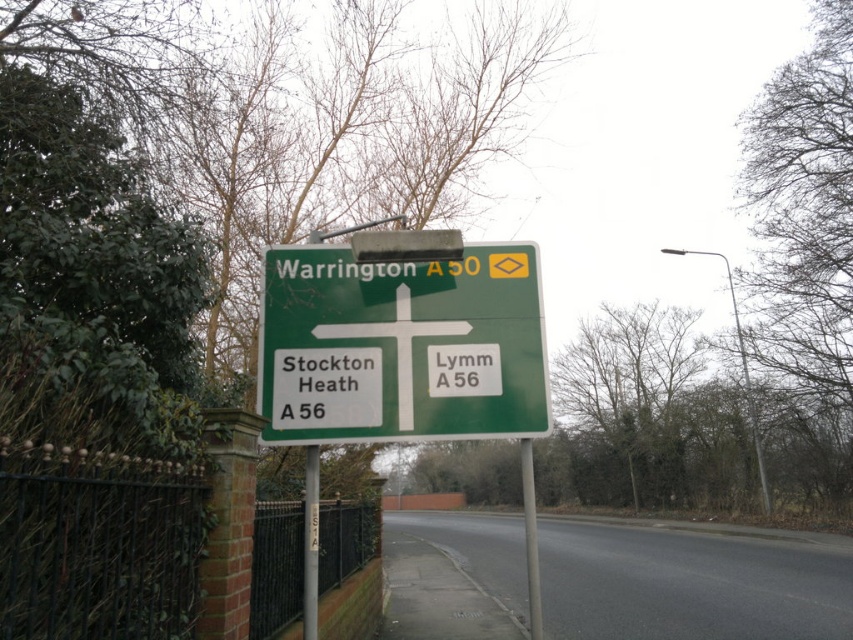
Which is more to the left, green matte sign at center or green plastic sign at center?

green matte sign at center

In the scene shown: Between green matte sign at center and green plastic sign at center, which one is positioned lower?

green plastic sign at center is below.

Who is more forward, [404,320] or [434,372]?

Point [434,372] is more forward.

Where is `green matte sign at center`? Image resolution: width=853 pixels, height=640 pixels. green matte sign at center is located at coordinates (401, 346).

Who is more distant from viewer, (439, 364) or (314, 445)?

Positioned behind is point (314, 445).

Is the position of green plastic sign at center more distant than that of metallic pole at center?

Yes, green plastic sign at center is behind metallic pole at center.

The height and width of the screenshot is (640, 853). Find the location of `green plastic sign at center`. green plastic sign at center is located at coordinates (463, 369).

Measure the distance between green plastic sign at center and gray metallic pole at center.

green plastic sign at center is 36.18 inches away from gray metallic pole at center.

Who is lower down, green plastic sign at center or gray metallic pole at center?

gray metallic pole at center is lower down.

At what (x,y) coordinates should I click in order to perform the action: click on green plastic sign at center. Please return your answer as a coordinate pair (x, y). The image size is (853, 640). Looking at the image, I should click on (463, 369).

In order to click on green plastic sign at center in this screenshot , I will do `click(463, 369)`.